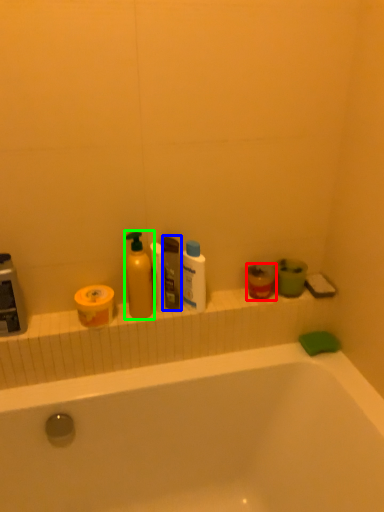
Question: Based on their relative distances, which object is farther from mouthwash (highlighted by a red box)? Choose from toiletry (highlighted by a blue box) and cleaning product (highlighted by a green box).

Choices:
 (A) toiletry
 (B) cleaning product

Answer: (B)